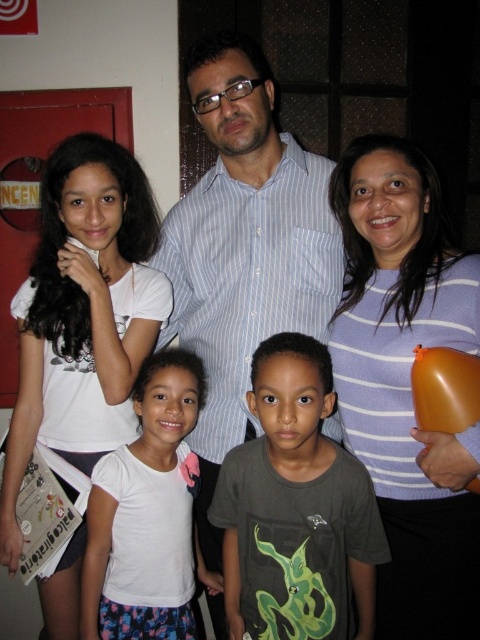
Is purple striped sweater at upper right positioned in front of white cotton shirt at center?

That is True.

Who is more forward, (429, 545) or (141, 474)?

Point (429, 545) is more forward.

Which is behind, point (343, 348) or point (187, 634)?

The point (187, 634) is more distant.

Identify the location of purple striped sweater at upper right. (407, 381).

Does point (405, 218) come farther from viewer compared to point (216, 269)?

No, (405, 218) is in front of (216, 269).

Who is positioned more to the right, purple striped sweater at upper right or blue striped shirt at center?

purple striped sweater at upper right

Between point (467, 602) and point (208, 289), which one is positioned behind?

Point (208, 289)

This screenshot has height=640, width=480. I want to click on purple striped sweater at upper right, so point(407,381).

Does purple striped sweater at upper right come behind dark gray t-shirt at center?

No, purple striped sweater at upper right is closer to the viewer.

Who is more forward, (351,289) or (276,609)?

Positioned in front is point (276,609).

Which is in front, point (356, 426) or point (285, 593)?

Point (285, 593) is in front.

At what (x,y) coordinates should I click in order to perform the action: click on purple striped sweater at upper right. Please return your answer as a coordinate pair (x, y). The height and width of the screenshot is (640, 480). Looking at the image, I should click on (407, 381).